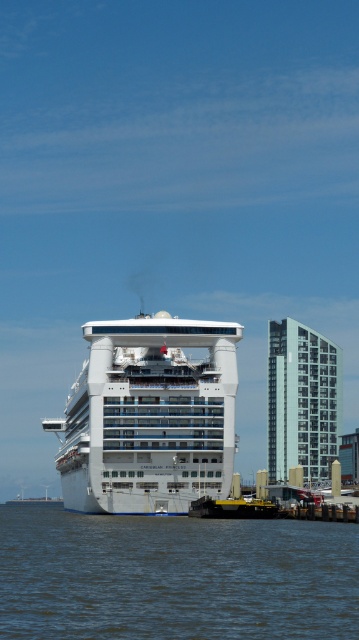
Is brown water at lower left in front of white glossy cruise ship at center?

Yes, it is.

Who is shorter, brown water at lower left or white glossy cruise ship at center?

brown water at lower left is shorter.

Who is more forward, (x=353, y=612) or (x=190, y=381)?

Positioned in front is point (x=353, y=612).

Locate an element on the screen. brown water at lower left is located at coordinates (174, 577).